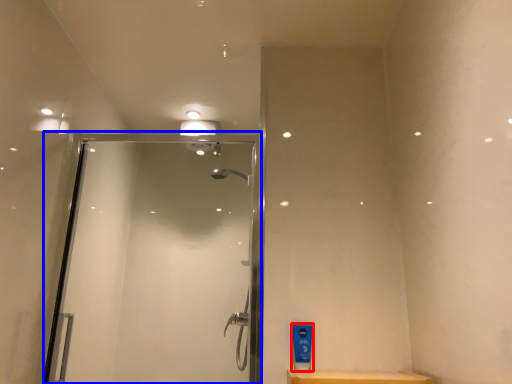
Question: Which object appears closest to the camera in this image, toiletry (highlighted by a red box) or screen door (highlighted by a blue box)?

Choices:
 (A) toiletry
 (B) screen door

Answer: (A)